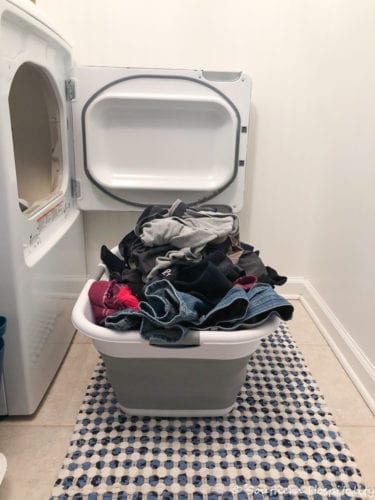
The width and height of the screenshot is (375, 500). What are the coordinates of `dryer door` in the screenshot? It's located at (161, 145).